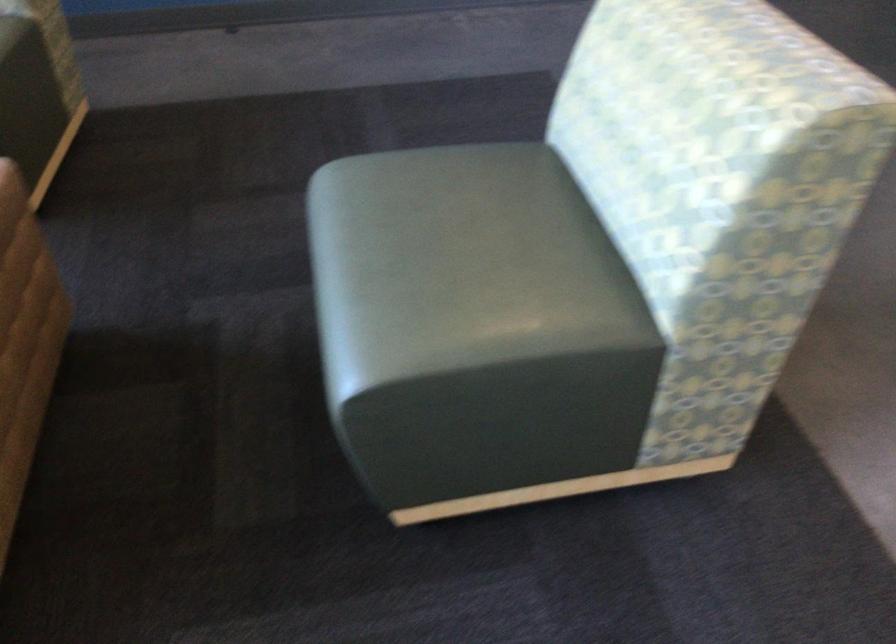
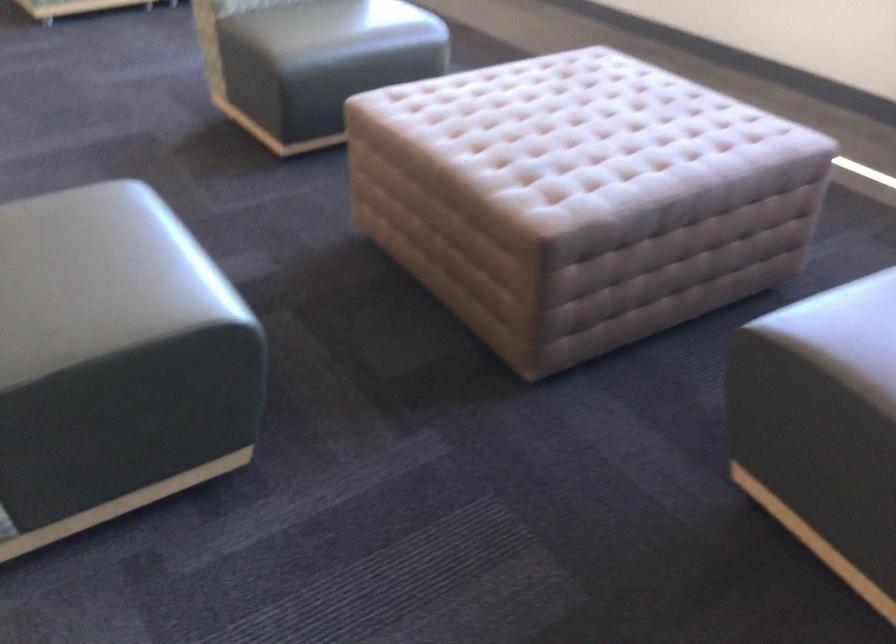
In the second image, find the point that corresponds to point (466, 176) in the first image.

(99, 278)